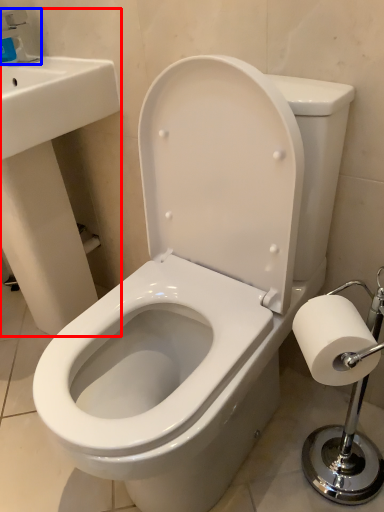
Question: Among these objects, which one is farthest to the camera, sink (highlighted by a red box) or faucet (highlighted by a blue box)?

Choices:
 (A) sink
 (B) faucet

Answer: (B)